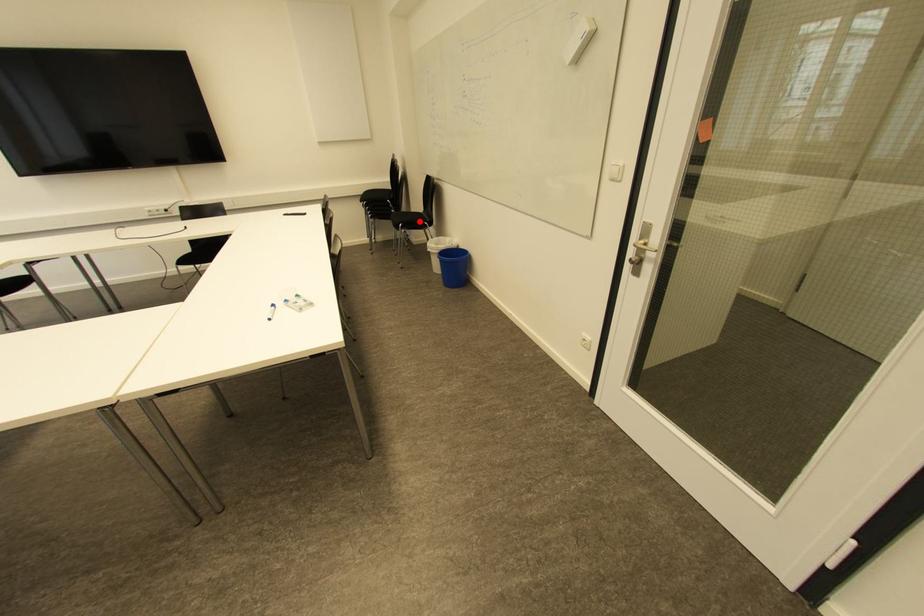
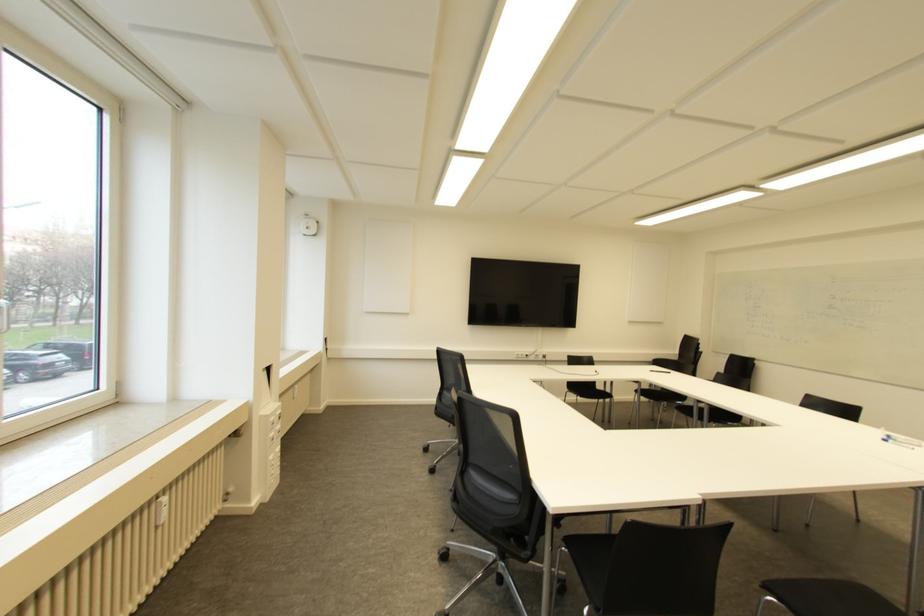
Question: I am providing you with two images of the same scene from different viewpoints. A red point is marked on the first image. At the location where the point appears in image 1, is it still visible in image 2?

Choices:
 (A) Yes
 (B) No

Answer: (B)